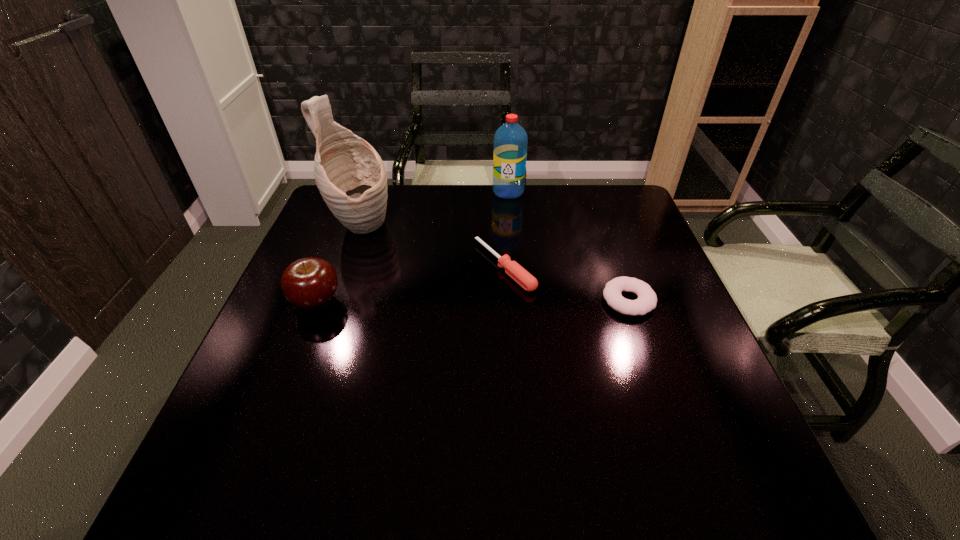
Where is `free space on the desktop that is between the apple and the doughnut and is positioned on the front label of the farthest object`? The width and height of the screenshot is (960, 540). free space on the desktop that is between the apple and the doughnut and is positioned on the front label of the farthest object is located at coordinates (445, 301).

This screenshot has width=960, height=540. I want to click on vacant spot on the desktop that is between the third shortest object and the rightmost object and is positioned at the tip of the screwdriver, so click(x=431, y=301).

Identify the location of vacant space on the desktop that is between the apple and the doughnut and is positioned at the spout of the tallest object. (511, 301).